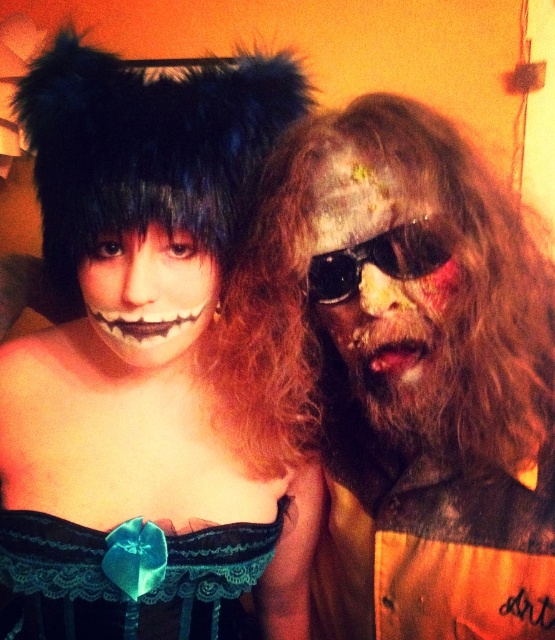
You are a photographer trying to capture a closeup shot of the zombie costume on the right. You are currently positioned 1.2 meters away from the point where you want to take the photo. If you move forward to the point at coordinate (105, 330), will you be close enough to get a detailed closeup?

The point at coordinate (105, 330) is 68.52 centimeters away from the camera. Moving forward from 1.2 meters to 68.52 centimeters would place you closer, so yes, you will be close enough to capture a detailed closeup of the zombie costume on the right.

You are standing in front of the image and need to locate the matte orange shirt at center. According to the coordinates provided, where exactly is it positioned?

The matte orange shirt at center is located at point 0.583 on the x axis and 0.750 on the y axis.

You are a costume designer preparing for a Halloween party. You have a matte orange shirt at center and a black plastic sunglasses at right. Which item would you choose to ensure it covers more of the wearer? Explain your choice based on their sizes.

The matte orange shirt at center is bigger than the black plastic sunglasses at right, so it would cover more of the wearer and is the better choice for covering a larger area.